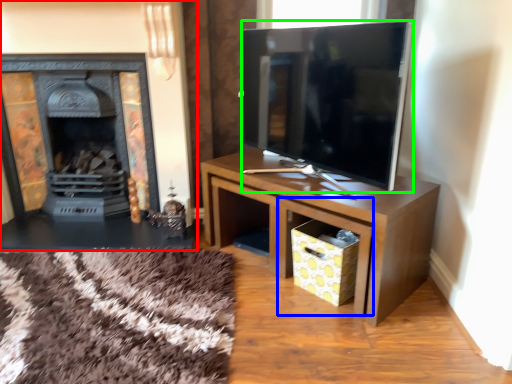
Question: Estimate the real-world distances between objects in this image. Which object is farther from fireplace (highlighted by a red box), drawer (highlighted by a blue box) or television (highlighted by a green box)?

Choices:
 (A) drawer
 (B) television

Answer: (A)